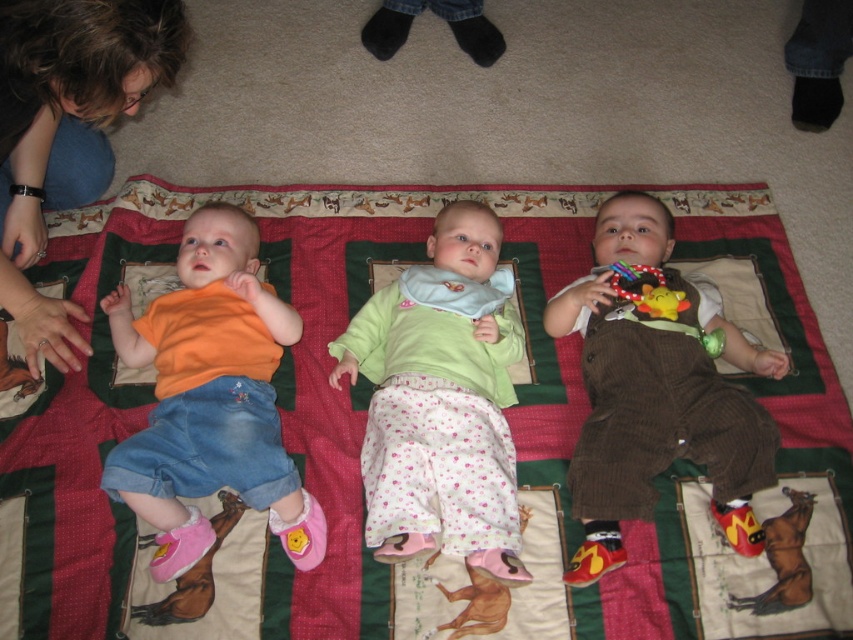
You are a photographer taking a picture of the three babies on the blanket. You notice a point at coordinates (68,128). Which baby is closest to this point?

The point at coordinates (68,128) corresponds to the brown hair at upper left, so the baby closest to this point is the one with brown hair at upper left.

You are a photographer taking a picture of the orange cotton shirt at left and the rubber teething ring at lower left. Which object will appear larger in the photo?

The orange cotton shirt at left will appear larger in the photo because it is taller than the rubber teething ring at lower left.